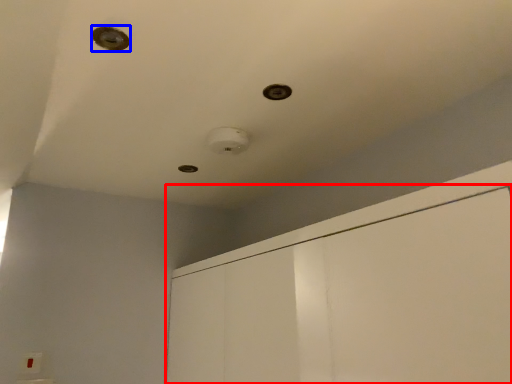
Question: Which object appears farthest to the camera in this image, dresser (highlighted by a red box) or hole (highlighted by a blue box)?

Choices:
 (A) dresser
 (B) hole

Answer: (B)